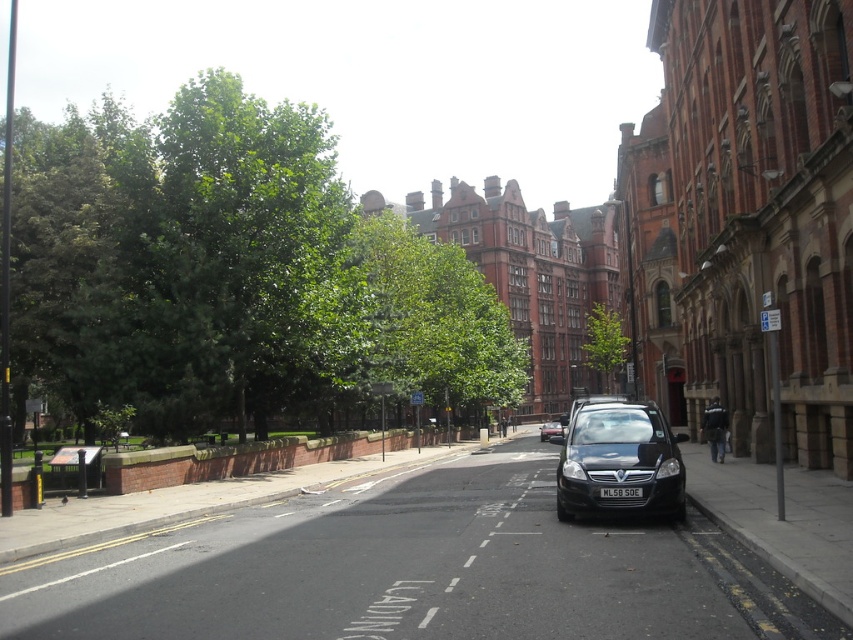
Is green leafy tree at upper left thinner than shiny black car at center?

No, green leafy tree at upper left is not thinner than shiny black car at center.

Is the position of green leafy tree at upper left less distant than that of shiny black car at center?

That is False.

Identify the location of green leafy tree at upper left. (231, 273).

Is shiny black car at center taller than black glossy car at center?

In fact, shiny black car at center may be shorter than black glossy car at center.

Is shiny black car at center smaller than black glossy car at center?

Correct, shiny black car at center occupies less space than black glossy car at center.

Image resolution: width=853 pixels, height=640 pixels. Describe the element at coordinates (619, 461) in the screenshot. I see `shiny black car at center` at that location.

Locate an element on the screen. Image resolution: width=853 pixels, height=640 pixels. shiny black car at center is located at coordinates (619, 461).

Based on the photo, who is positioned more to the left, shiny black car at center or green leafy tree at center?

Positioned to the left is shiny black car at center.

At what (x,y) coordinates should I click in order to perform the action: click on shiny black car at center. Please return your answer as a coordinate pair (x, y). Looking at the image, I should click on pyautogui.click(x=619, y=461).